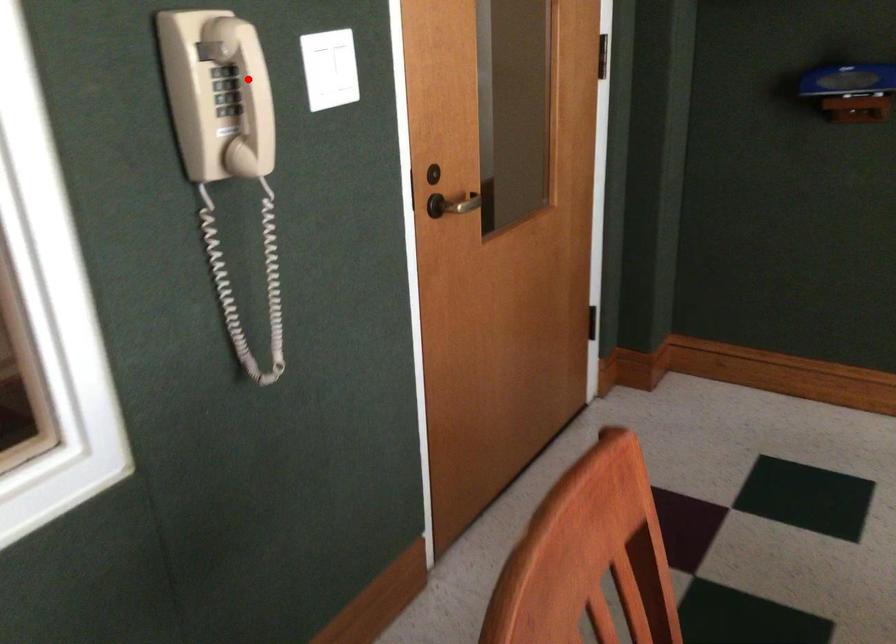
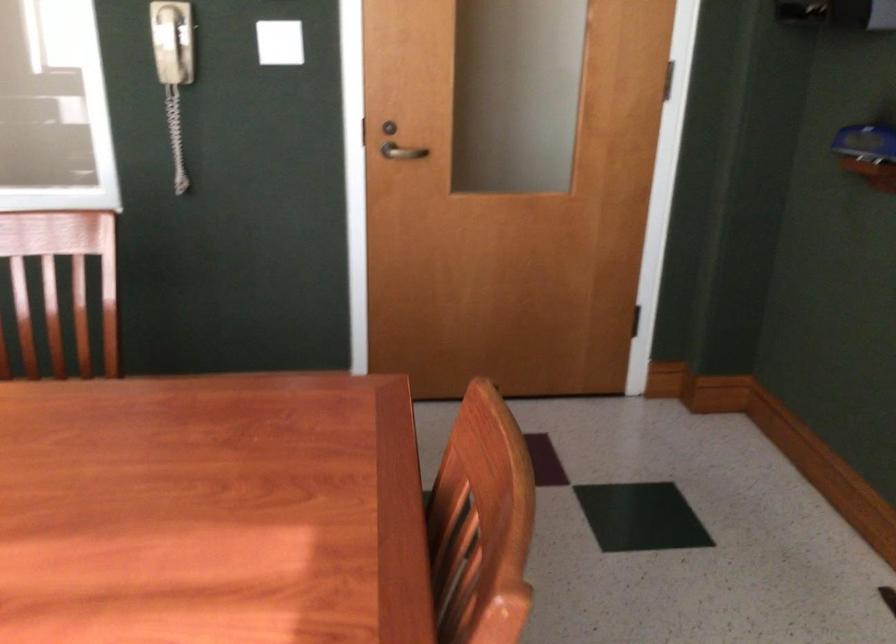
The point at the highlighted location is marked in the first image. Where is the corresponding point in the second image?

(171, 41)